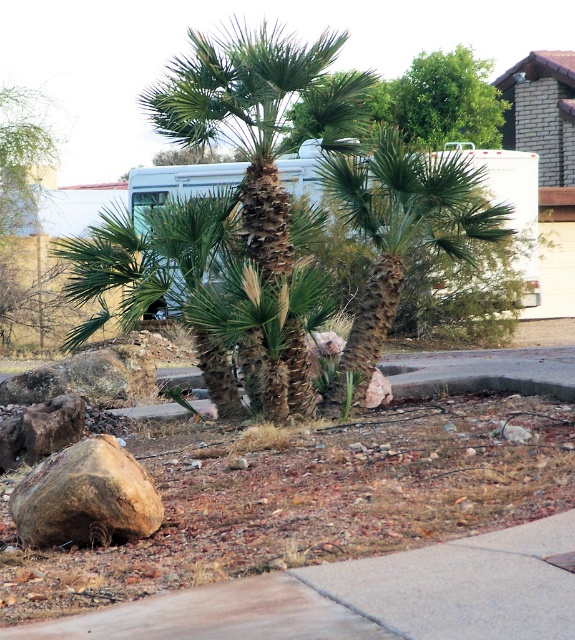
Who is higher up, green textured palm tree at center or white matte recreational vehicle at center?

Positioned higher is white matte recreational vehicle at center.

Between green textured palm tree at center and white matte recreational vehicle at center, which one appears on the left side from the viewer's perspective?

From the viewer's perspective, white matte recreational vehicle at center appears more on the left side.

Between point (386, 140) and point (527, 195), which one is positioned in front?

Point (386, 140) is in front.

Find the location of `green textured palm tree at center`. green textured palm tree at center is located at coordinates (400, 236).

Is concrete at lower center above green leafy tree at upper center?

No, concrete at lower center is not above green leafy tree at upper center.

Between concrete at lower center and green leafy tree at upper center, which one is positioned lower?

concrete at lower center

Locate an element on the screen. concrete at lower center is located at coordinates (366, 596).

This screenshot has height=640, width=575. I want to click on concrete at lower center, so click(x=366, y=596).

Describe the element at coordinates (366, 596) in the screenshot. I see `concrete at lower center` at that location.

Does concrete at lower center appear on the left side of white matte recreational vehicle at center?

Incorrect, concrete at lower center is not on the left side of white matte recreational vehicle at center.

Locate an element on the screen. concrete at lower center is located at coordinates (366, 596).